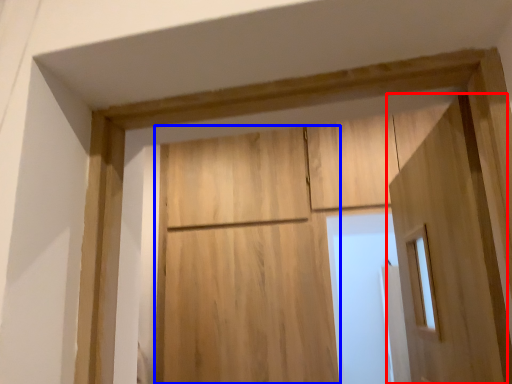
Question: Among these objects, which one is farthest to the camera, door (highlighted by a red box) or barn door (highlighted by a blue box)?

Choices:
 (A) door
 (B) barn door

Answer: (B)